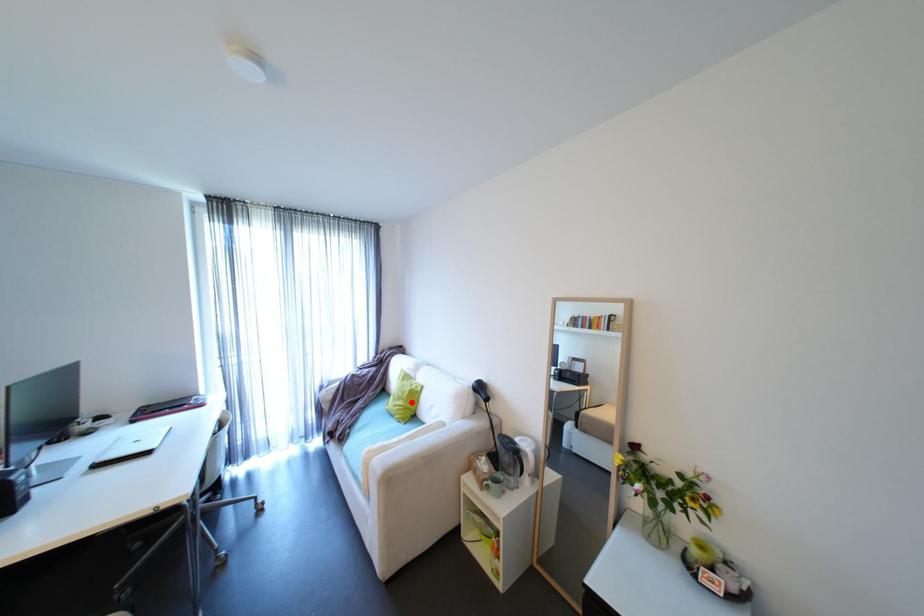
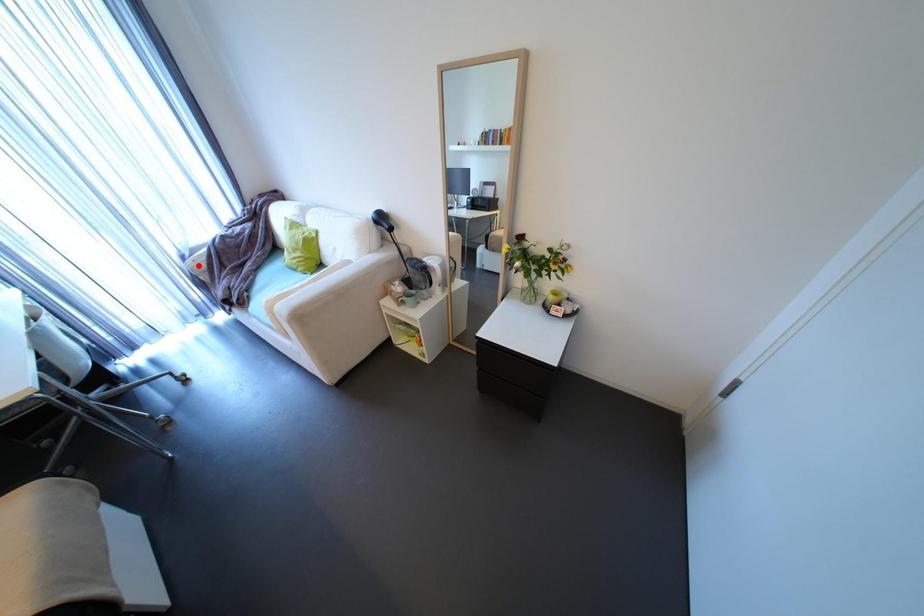
I am providing you with two images of the same scene from different viewpoints. A red point is marked on the first image and another point is marked on the second image. Are the points marked in image1 and image2 representing the same 3D position?

No